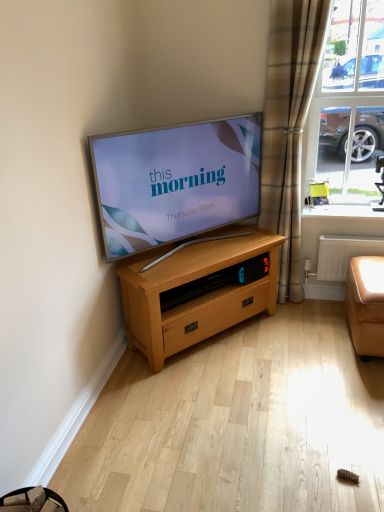
Image resolution: width=384 pixels, height=512 pixels. What are the coordinates of `vacant area situated below matte silver tv at center (from a real-world perspective)` in the screenshot? It's located at (163, 252).